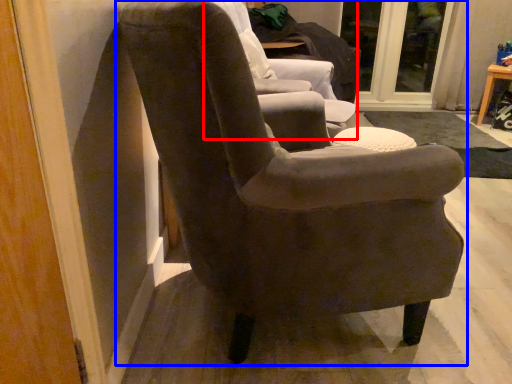
Question: Which point is further to the camera, chair (highlighted by a red box) or chair (highlighted by a blue box)?

Choices:
 (A) chair
 (B) chair

Answer: (A)